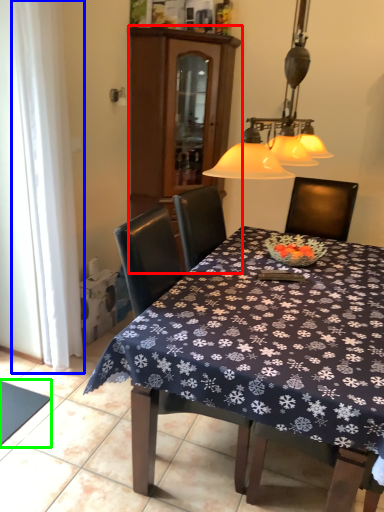
Question: Which is nearer to the cabinetry (highlighted by a red box)? curtain (highlighted by a blue box) or tablecloth (highlighted by a green box).

Choices:
 (A) curtain
 (B) tablecloth

Answer: (A)